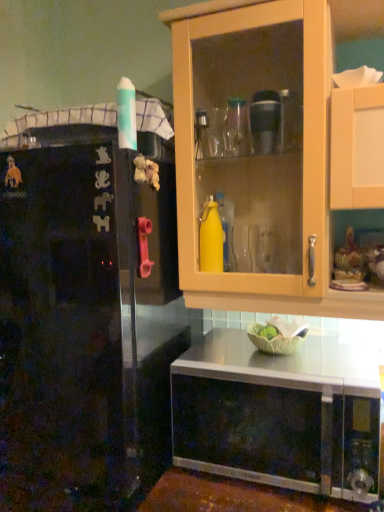
Locate an element on the screen. This screenshot has width=384, height=512. stainless steel microwave at lower center is located at coordinates (279, 414).

This screenshot has height=512, width=384. What do you see at coordinates (279, 414) in the screenshot?
I see `stainless steel microwave at lower center` at bounding box center [279, 414].

Describe the element at coordinates (85, 321) in the screenshot. I see `black matte refrigerator at left` at that location.

The width and height of the screenshot is (384, 512). I want to click on black matte refrigerator at left, so click(x=85, y=321).

Find the location of `stainless steel microwave at lower center`. stainless steel microwave at lower center is located at coordinates (279, 414).

In the image, is black matte refrigerator at left on the left side or the right side of stainless steel microwave at lower center?

black matte refrigerator at left is positioned on stainless steel microwave at lower center's left side.

Considering their positions, is black matte refrigerator at left located in front of or behind stainless steel microwave at lower center?

In the image, black matte refrigerator at left appears in front of stainless steel microwave at lower center.

Which is closer, [19,451] or [227,448]?

Point [19,451] is positioned closer to the camera compared to point [227,448].

From the image's perspective, is black matte refrigerator at left over stainless steel microwave at lower center?

No, from the image's perspective, black matte refrigerator at left is not over stainless steel microwave at lower center.

From a real-world perspective, who is located higher, black matte refrigerator at left or stainless steel microwave at lower center?

From a 3D spatial view, stainless steel microwave at lower center is above.

Which of these two, black matte refrigerator at left or stainless steel microwave at lower center, is thinner?

stainless steel microwave at lower center is thinner.

Considering the relative sizes of black matte refrigerator at left and stainless steel microwave at lower center in the image provided, is black matte refrigerator at left shorter than stainless steel microwave at lower center?

No, black matte refrigerator at left is not shorter than stainless steel microwave at lower center.

Does black matte refrigerator at left have a larger size compared to stainless steel microwave at lower center?

Yes, black matte refrigerator at left is bigger than stainless steel microwave at lower center.

Is black matte refrigerator at left outside of stainless steel microwave at lower center?

Yes.

Is black matte refrigerator at left far from stainless steel microwave at lower center?

No, there isn't a large distance between black matte refrigerator at left and stainless steel microwave at lower center.

Is black matte refrigerator at left looking in the opposite direction of stainless steel microwave at lower center?

No, black matte refrigerator at left's orientation is not away from stainless steel microwave at lower center.

Identify the location of refrigerator located underneath the stainless steel microwave at lower center (from a real-world perspective). (85, 321).

From the picture: Is stainless steel microwave at lower center at the left side of black matte refrigerator at left?

Incorrect, stainless steel microwave at lower center is not on the left side of black matte refrigerator at left.

Based on the photo, considering the positions of objects stainless steel microwave at lower center and black matte refrigerator at left in the image provided, who is in front, stainless steel microwave at lower center or black matte refrigerator at left?

black matte refrigerator at left is in front.

Is point (326, 336) closer or farther from the camera than point (28, 412)?

Clearly, point (326, 336) is more distant from the camera than point (28, 412).

From the image's perspective, is stainless steel microwave at lower center on top of black matte refrigerator at left?

Yes, from the image's perspective, stainless steel microwave at lower center is on top of black matte refrigerator at left.

From a real-world perspective, is stainless steel microwave at lower center on black matte refrigerator at left?

Yes, from a real-world perspective, stainless steel microwave at lower center is on top of black matte refrigerator at left.

Considering the relative sizes of stainless steel microwave at lower center and black matte refrigerator at left in the image provided, is stainless steel microwave at lower center thinner than black matte refrigerator at left?

Correct, the width of stainless steel microwave at lower center is less than that of black matte refrigerator at left.

Which of these two, stainless steel microwave at lower center or black matte refrigerator at left, stands shorter?

stainless steel microwave at lower center.

Which of these two, stainless steel microwave at lower center or black matte refrigerator at left, is smaller?

stainless steel microwave at lower center.

Is stainless steel microwave at lower center inside the boundaries of black matte refrigerator at left, or outside?

stainless steel microwave at lower center is spatially situated outside black matte refrigerator at left.

In the scene shown: Is stainless steel microwave at lower center with black matte refrigerator at left?

No, stainless steel microwave at lower center is not beside black matte refrigerator at left.

Does stainless steel microwave at lower center turn towards black matte refrigerator at left?

No, stainless steel microwave at lower center is not turned towards black matte refrigerator at left.

Can you tell me how much stainless steel microwave at lower center and black matte refrigerator at left differ in facing direction?

The facing directions of stainless steel microwave at lower center and black matte refrigerator at left are 0.992 degrees apart.

How much distance is there between stainless steel microwave at lower center and black matte refrigerator at left?

The distance of stainless steel microwave at lower center from black matte refrigerator at left is 12.58 inches.

The width and height of the screenshot is (384, 512). I want to click on cabinetry on the right of black matte refrigerator at left, so click(x=279, y=414).

Identify the location of refrigerator in front of the stainless steel microwave at lower center. Image resolution: width=384 pixels, height=512 pixels. (85, 321).

You are a GUI agent. You are given a task and a screenshot of the screen. Output one action in this format:
    pyautogui.click(x=<x>, y=<y>)
    Task: Click on the cabinetry lying above the black matte refrigerator at left (from the image's perspective)
    
    Given the screenshot: What is the action you would take?
    pyautogui.click(x=279, y=414)